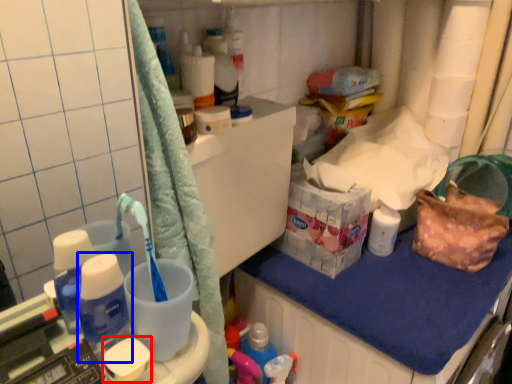
Question: Which of the following is the closest to the observer, soap (highlighted by a red box) or bottle (highlighted by a blue box)?

Choices:
 (A) soap
 (B) bottle

Answer: (B)